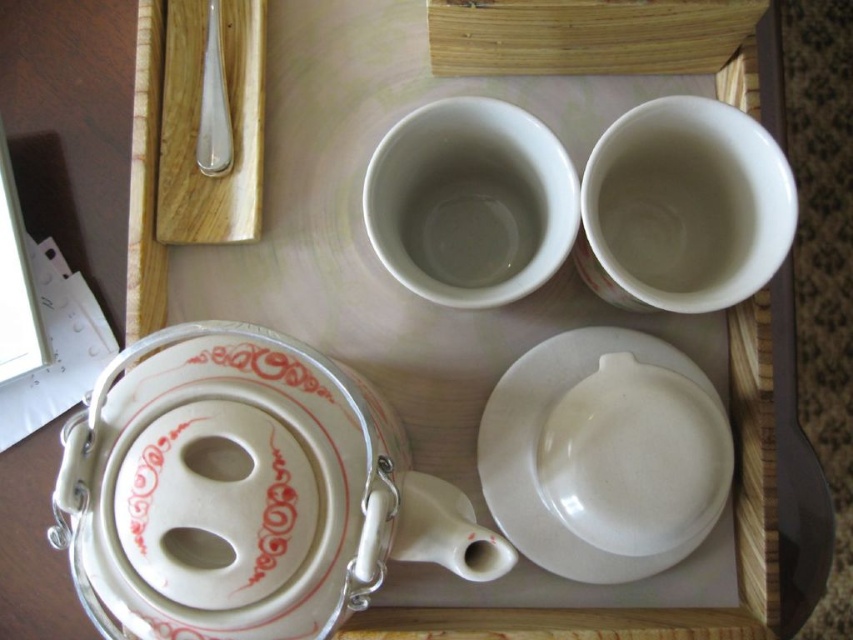
In the scene shown: Which of these two, white glossy teapot at bottom left or white glossy platter at center, stands taller?

With more height is white glossy platter at center.

Between white glossy teapot at bottom left and white glossy platter at center, which one appears on the right side from the viewer's perspective?

white glossy platter at center is more to the right.

The width and height of the screenshot is (853, 640). In order to click on white glossy teapot at bottom left in this screenshot , I will do `click(247, 492)`.